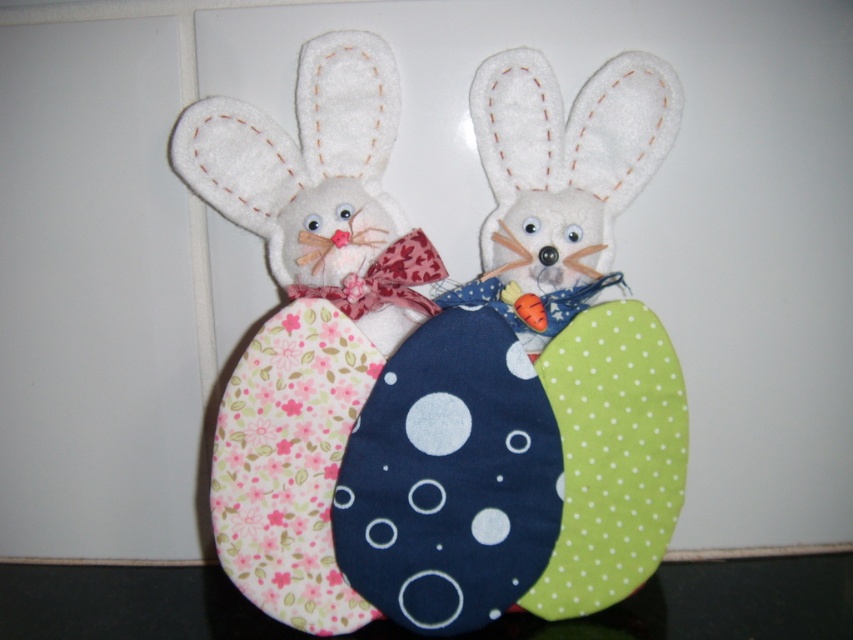
Question: Can you confirm if fluffy fabric bunny at center is positioned to the right of fluffy white bunny at left?

Choices:
 (A) yes
 (B) no

Answer: (A)

Question: Which object appears closest to the camera in this image?

Choices:
 (A) fluffy white bunny at left
 (B) fluffy fabric bunny at center

Answer: (B)

Question: Does fluffy fabric bunny at center have a lesser width compared to fluffy white bunny at left?

Choices:
 (A) yes
 (B) no

Answer: (B)

Question: Considering the relative positions of fluffy fabric bunny at center and fluffy white bunny at left in the image provided, where is fluffy fabric bunny at center located with respect to fluffy white bunny at left?

Choices:
 (A) below
 (B) above

Answer: (A)